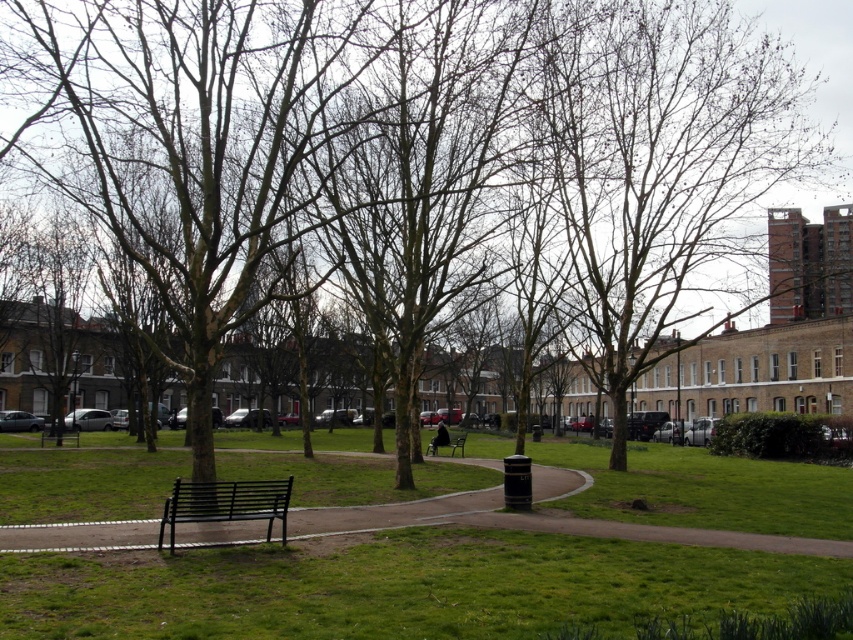
Question: Does smooth concrete path at center appear on the left side of black metal bench at center?

Choices:
 (A) no
 (B) yes

Answer: (A)

Question: Does green grass at center appear under black metal bench at center?

Choices:
 (A) yes
 (B) no

Answer: (A)

Question: Is green grass at center behind smooth concrete path at center?

Choices:
 (A) no
 (B) yes

Answer: (A)

Question: Which point appears farthest from the camera in this image?

Choices:
 (A) (740, 160)
 (B) (471, 497)
 (C) (721, 470)

Answer: (C)

Question: Which of the following is the farthest from the observer?

Choices:
 (A) smooth concrete path at center
 (B) black metal bench at center

Answer: (B)

Question: Which of the following is the farthest from the observer?

Choices:
 (A) black metal bench at center
 (B) bare branches at center
 (C) green grass at center

Answer: (B)